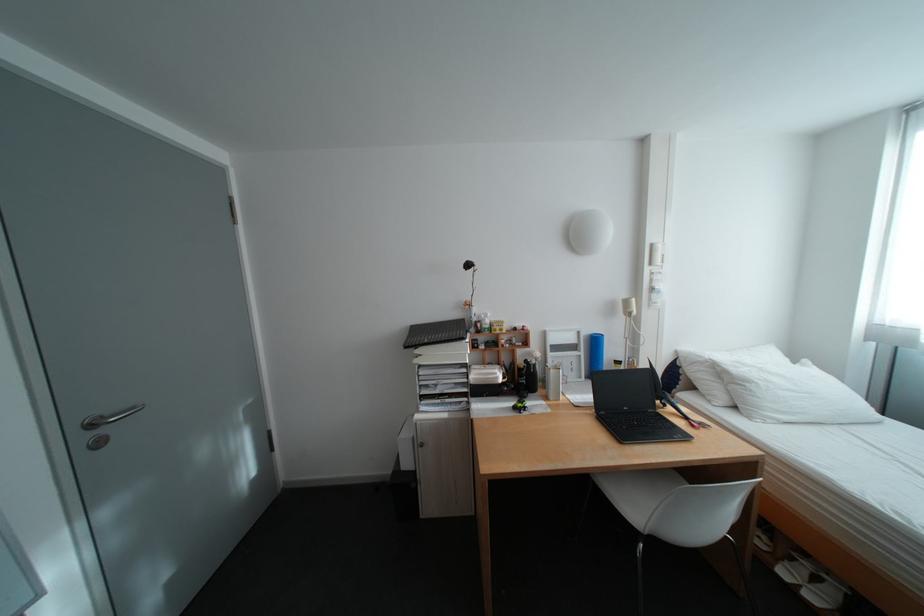
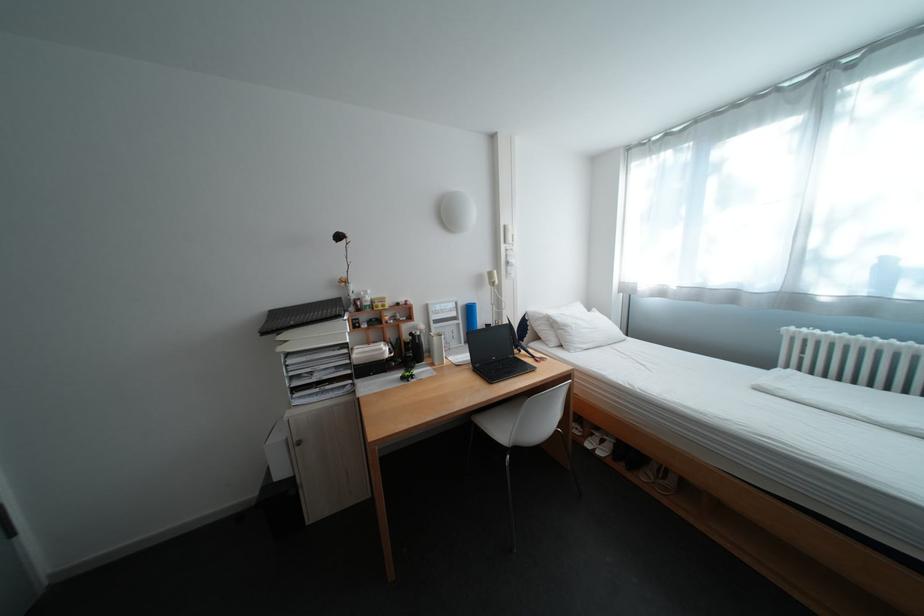
Question: The camera is either moving clockwise (left) or counter-clockwise (right) around the object. The first image is from the beginning of the video and the second image is from the end. Is the camera moving left or right when shooting the video?

Choices:
 (A) Left
 (B) Right

Answer: (A)